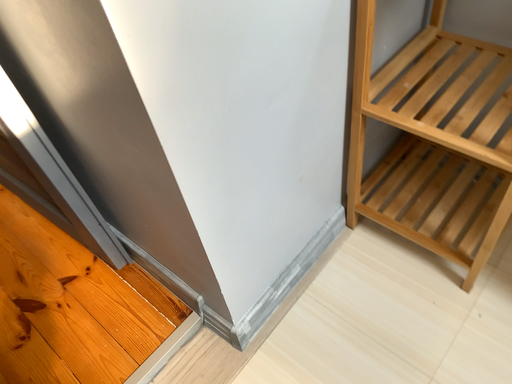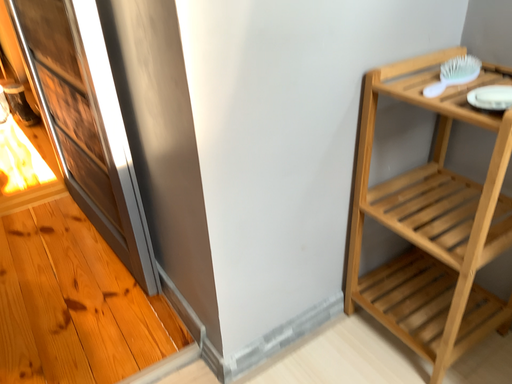
Question: How did the camera likely rotate when shooting the video?

Choices:
 (A) rotated right
 (B) rotated left

Answer: (B)